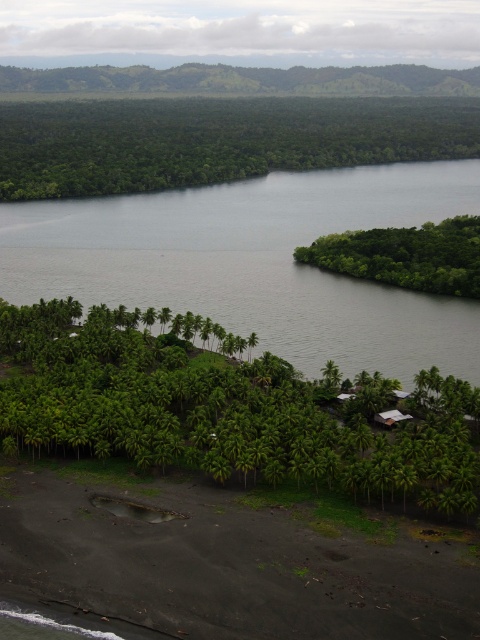
You are standing on a tropical beach and want to take a photo of the green leafy palm trees at lower center. If your camera has a maximum zoom range of 100 meters, will you be able to capture the trees clearly without moving closer?

The green leafy palm trees at lower center are 112.17 meters away from the viewer. Since the camera can only zoom up to 100 meters, you won

You are a bird soaring above the tropical coastal landscape. You see the green leafy forest at upper center and the green leafy island at right. Which one is located higher from the ground?

The green leafy forest at upper center is positioned over the green leafy island at right, so it is higher from the ground.

You are a drone operator tasked with capturing aerial footage of the tropical coastal landscape. Your camera has a limited field of view that can only focus on one area at a time. Which area should you prioritize to capture more of the green leafy palm trees at lower center and green leafy forest at upper center combined?

You should prioritize capturing the green leafy forest at upper center because it occupies more space than the green leafy palm trees at lower center, resulting in a larger combined area when focused on.